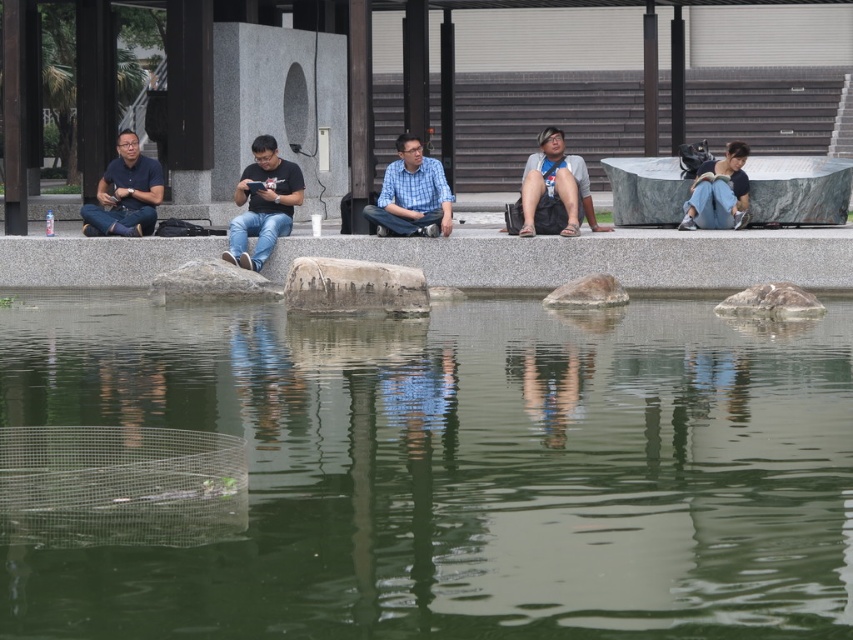
In the scene shown: Is matte black shirt at left thinner than gray rough stone at center?

Correct, matte black shirt at left's width is less than gray rough stone at center's.

Who is positioned more to the right, matte black shirt at left or gray rough stone at center?

gray rough stone at center is more to the right.

Between point (137, 147) and point (189, 284), which one is positioned behind?

Point (137, 147)

At what (x,y) coordinates should I click in order to perform the action: click on matte black shirt at left. Please return your answer as a coordinate pair (x, y). The width and height of the screenshot is (853, 640). Looking at the image, I should click on (125, 193).

From the picture: Which of these two, matte black shirt at center or gray stone at center, stands taller?

With more height is matte black shirt at center.

Does point (248, 268) come farther from viewer compared to point (596, 289)?

Yes, point (248, 268) is farther from viewer.

Identify the location of matte black shirt at center. The width and height of the screenshot is (853, 640). (263, 204).

In the scene shown: Does gray granite ledge at center come behind denim jeans at right?

No, gray granite ledge at center is in front of denim jeans at right.

Does point (653, 237) come farther from viewer compared to point (732, 152)?

That is False.

I want to click on gray granite ledge at center, so click(599, 257).

Identify the location of gray granite ledge at center. Image resolution: width=853 pixels, height=640 pixels. (599, 257).